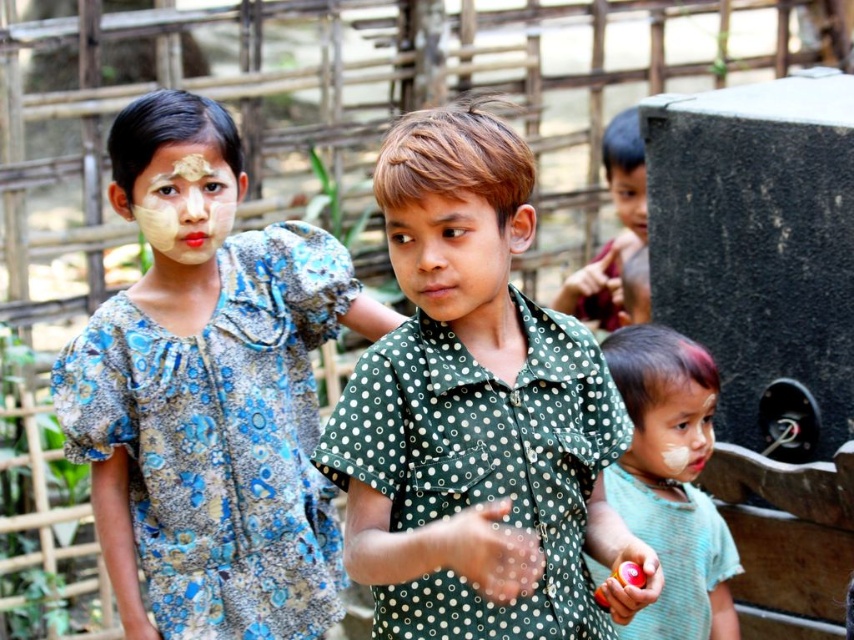
Question: Which of the following is the farthest from the observer?

Choices:
 (A) (638, 182)
 (B) (445, 275)

Answer: (A)

Question: Based on their relative distances, which object is farther from the light blue cotton shirt at lower right?

Choices:
 (A) light brown hair at upper right
 (B) rubberized plastic ball at lower right
 (C) green dotted shirt at center
 (D) smooth green shirt at center

Answer: (A)

Question: Can you confirm if matte yellow face at upper left is positioned to the right of smooth skin face at upper right?

Choices:
 (A) no
 (B) yes

Answer: (A)

Question: Can you confirm if matte yellow face at upper left is positioned to the right of light brown hair at upper right?

Choices:
 (A) no
 (B) yes

Answer: (A)

Question: Among these points, which one is nearest to the camera?

Choices:
 (A) (683, 394)
 (B) (212, 186)
 (C) (404, 209)
 (D) (203, 344)

Answer: (C)

Question: Does matte yellow face at upper left have a lesser width compared to light brown hair at upper right?

Choices:
 (A) no
 (B) yes

Answer: (B)